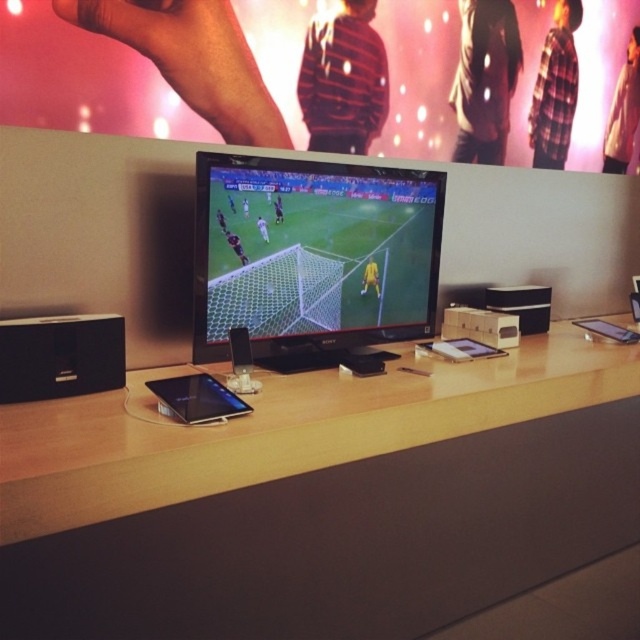
You are organizing a small tech showcase and need to place a new device on the wooden table at center. However, the table is already holding the black plastic speaker at lower left. Can the new device fit on the table without removing the speaker?

The wooden table at center is larger in size than the black plastic speaker at lower left, so there is likely enough space to place the new device without removing the speaker.